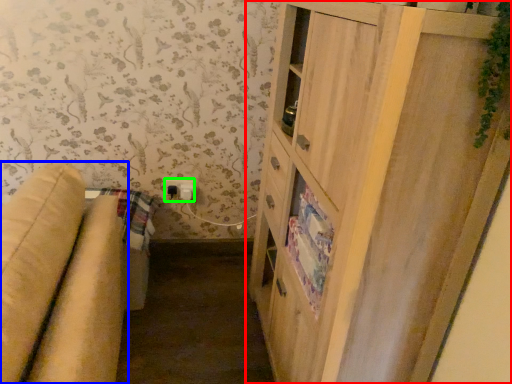
Question: Considering the real-world distances, which object is closest to cupboard (highlighted by a red box)? studio couch (highlighted by a blue box) or electric outlet (highlighted by a green box).

Choices:
 (A) studio couch
 (B) electric outlet

Answer: (A)